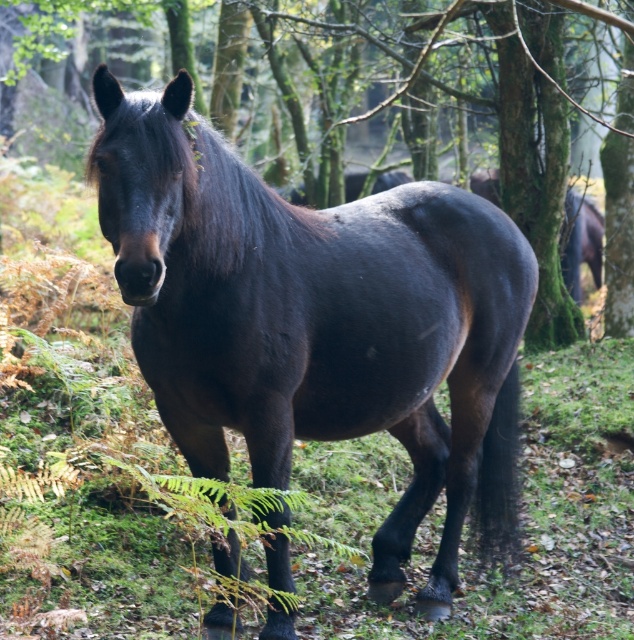
You are a photographer trying to capture the shiny dark brown horse at center and the green mossy tree at center in a single frame. Based on their positions, will the horse appear closer to the camera than the tree?

Yes, the shiny dark brown horse at center is positioned in front of the green mossy tree at center, so it will appear closer to the camera.

You are a hiker who wants to take a photo of both the shiny dark brown horse at center and the green mossy tree at center. Since you can only focus on one object at a time, which object should you focus on first to ensure the other is still in the frame?

The shiny dark brown horse at center is to the left of the green mossy tree at center, so you should focus on the shiny dark brown horse at center first to ensure the green mossy tree at center remains in the frame.